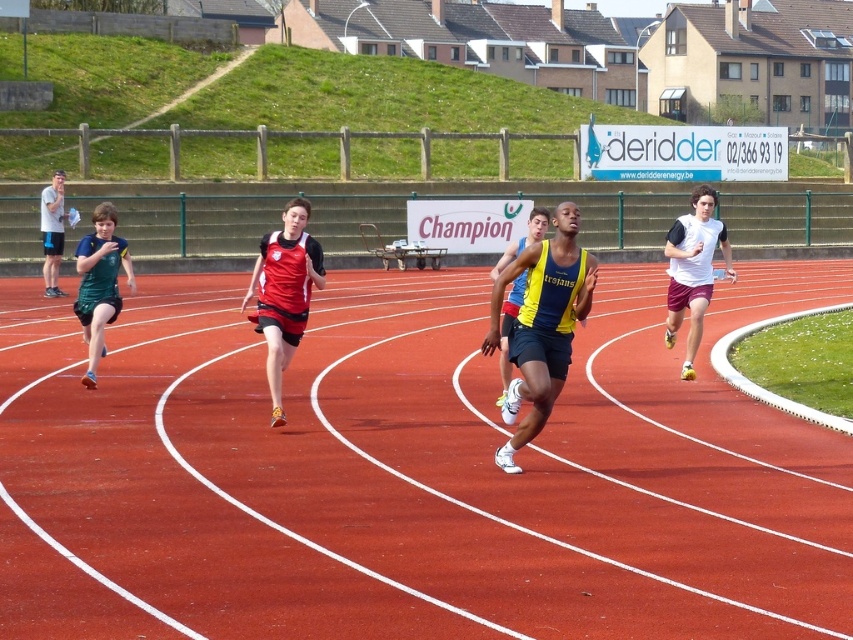
Question: Can you confirm if red rubber track at center is positioned to the left of yellow/blue jersey at center?

Choices:
 (A) no
 (B) yes

Answer: (A)

Question: Is yellow/blue jersey at center wider than matte gray shirt at left?

Choices:
 (A) yes
 (B) no

Answer: (A)

Question: Which point appears farthest from the camera in this image?

Choices:
 (A) (727, 269)
 (B) (567, 204)
 (C) (517, 248)
 (D) (47, 212)

Answer: (D)

Question: Can you confirm if red matte jersey at center is thinner than matte gray shirt at left?

Choices:
 (A) yes
 (B) no

Answer: (B)

Question: Which object appears closest to the camera in this image?

Choices:
 (A) red rubber track at center
 (B) yellow/blue jersey at center
 (C) red matte jersey at center

Answer: (A)

Question: Among these objects, which one is farthest from the camera?

Choices:
 (A) yellow/blue jersey at center
 (B) red matte jersey at center

Answer: (B)